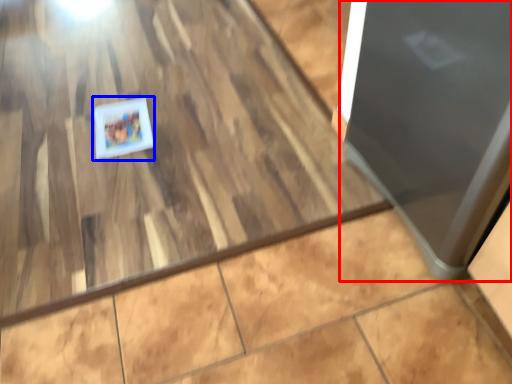
Question: Which object appears closest to the camera in this image, door (highlighted by a red box) or postcard (highlighted by a blue box)?

Choices:
 (A) door
 (B) postcard

Answer: (A)